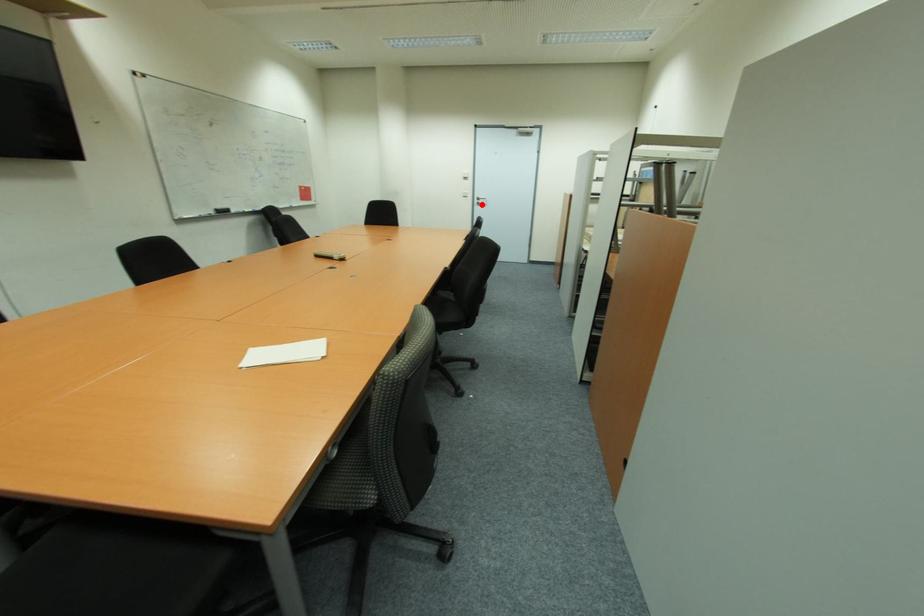
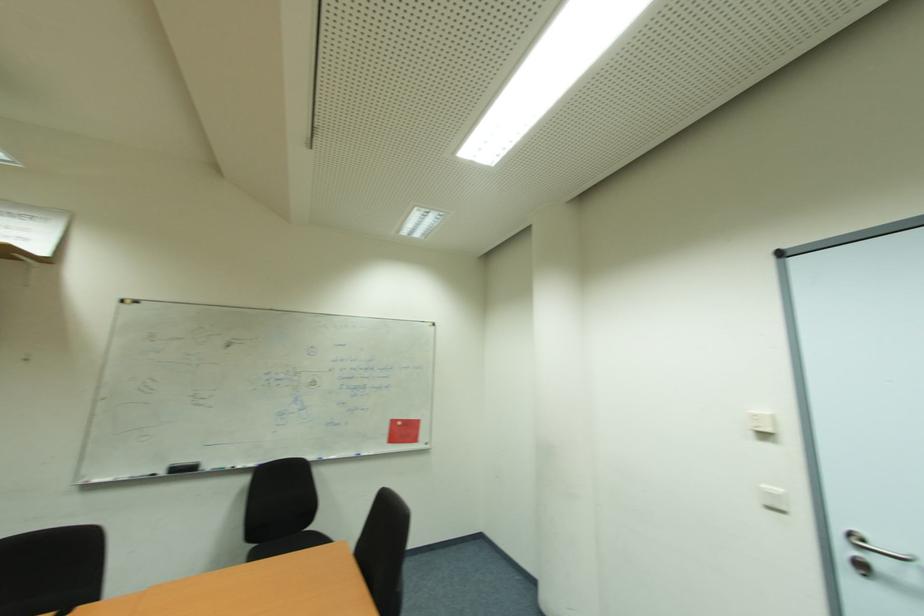
The point at the highlighted location is marked in the first image. Where is the corresponding point in the second image?

(869, 570)